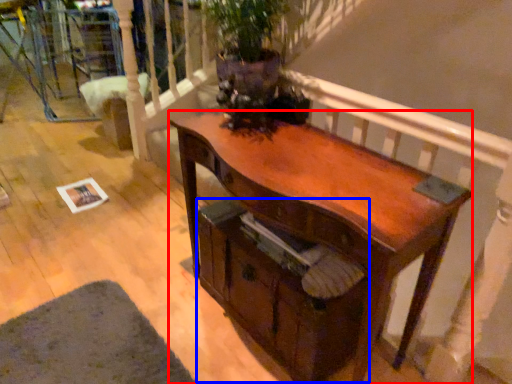
Question: Which object appears closest to the camera in this image, desk (highlighted by a red box) or drawer (highlighted by a blue box)?

Choices:
 (A) desk
 (B) drawer

Answer: (A)